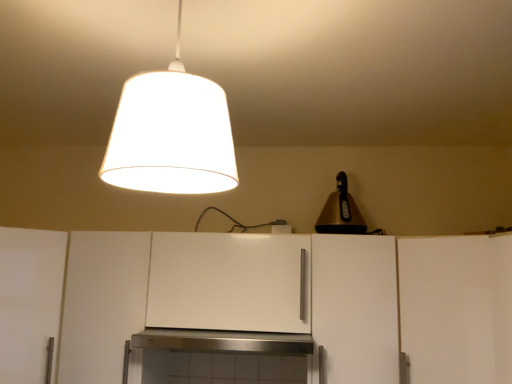
This screenshot has height=384, width=512. What are the coordinates of `white matte cabinet at center, which ranks as the third cabinetry in left-to-right order` in the screenshot? It's located at (230, 282).

The width and height of the screenshot is (512, 384). Describe the element at coordinates (456, 308) in the screenshot. I see `white matte cabinet at right, which is counted as the 5th cabinetry, starting from the left` at that location.

This screenshot has height=384, width=512. I want to click on white matte cabinet at right, which ranks as the 1th cabinetry in right-to-left order, so click(x=456, y=308).

The height and width of the screenshot is (384, 512). I want to click on white fabric lampshade at upper center, placed as the 1th lamp when sorted from front to back, so click(x=170, y=134).

Where is `white matte cabinet at lower left, which appears as the 2th cabinetry when viewed from the left`? white matte cabinet at lower left, which appears as the 2th cabinetry when viewed from the left is located at coordinates (102, 303).

How much space does white matte cabinet at lower left, the 4th cabinetry when ordered from right to left, occupy horizontally?

It is 16.80 inches.

The height and width of the screenshot is (384, 512). Identify the location of white matte cabinet at center, which appears as the 2th cabinetry when viewed from the right. (355, 308).

In order to click on white matte cabinet at center, arranged as the third cabinetry when viewed from the right in this screenshot , I will do `click(230, 282)`.

Is white matte cabinet at lower left, which appears as the 2th cabinetry when viewed from the left, bigger or smaller than white matte cabinet at center, which ranks as the third cabinetry in left-to-right order?

Clearly, white matte cabinet at lower left, which appears as the 2th cabinetry when viewed from the left, is larger in size than white matte cabinet at center, which ranks as the third cabinetry in left-to-right order.

In the scene shown: Would you say white matte cabinet at lower left, which appears as the 2th cabinetry when viewed from the left, is outside white matte cabinet at center, arranged as the third cabinetry when viewed from the right?

That's correct, white matte cabinet at lower left, which appears as the 2th cabinetry when viewed from the left, is outside of white matte cabinet at center, arranged as the third cabinetry when viewed from the right.

From the image's perspective, is white matte cabinet at lower left, the 4th cabinetry when ordered from right to left, located above white matte cabinet at center, which ranks as the third cabinetry in left-to-right order?

Actually, white matte cabinet at lower left, the 4th cabinetry when ordered from right to left, appears below white matte cabinet at center, which ranks as the third cabinetry in left-to-right order, in the image.

Which of these two, white matte cabinet at lower left, which appears as the 2th cabinetry when viewed from the left, or white matte cabinet at center, which ranks as the third cabinetry in left-to-right order, stands shorter?

white matte cabinet at center, which ranks as the third cabinetry in left-to-right order.

From the picture: Does white matte cabinet at lower left, the 4th cabinetry when ordered from right to left, have a lesser width compared to white fabric lampshade at upper center, which appears as the second lamp when viewed from the back?

No.

Which is correct: white matte cabinet at lower left, the 4th cabinetry when ordered from right to left, is inside white fabric lampshade at upper center, which ranks as the 1th lamp in left-to-right order, or outside of it?

white matte cabinet at lower left, the 4th cabinetry when ordered from right to left, is spatially situated outside white fabric lampshade at upper center, which ranks as the 1th lamp in left-to-right order.

Which lamp is the 1st one when counting from the right side of the white matte cabinet at lower left, which appears as the 2th cabinetry when viewed from the left? Please provide its 2D coordinates.

[(170, 134)]

From the image's perspective, who appears lower, white matte cabinet at lower left, which appears as the 2th cabinetry when viewed from the left, or white fabric lampshade at upper center, which ranks as the 1th lamp in left-to-right order?

white matte cabinet at lower left, which appears as the 2th cabinetry when viewed from the left, appears lower in the image.

From the image's perspective, would you say white matte cabinet at center, which appears as the 2th cabinetry when viewed from the right, is positioned over white matte cabinet at left, the fifth cabinetry viewed from the right?

Yes, from the image's perspective, white matte cabinet at center, which appears as the 2th cabinetry when viewed from the right, is over white matte cabinet at left, the fifth cabinetry viewed from the right.

Is white matte cabinet at center, which appears as the 2th cabinetry when viewed from the right, thinner than white matte cabinet at left, the fifth cabinetry viewed from the right?

Yes, white matte cabinet at center, which appears as the 2th cabinetry when viewed from the right, is thinner than white matte cabinet at left, the fifth cabinetry viewed from the right.

Considering the sizes of objects white matte cabinet at center, which appears as the 2th cabinetry when viewed from the right, and white matte cabinet at left, the fifth cabinetry viewed from the right, in the image provided, who is taller, white matte cabinet at center, which appears as the 2th cabinetry when viewed from the right, or white matte cabinet at left, the fifth cabinetry viewed from the right,?

With more height is white matte cabinet at left, the fifth cabinetry viewed from the right.

Which point is more forward, [327,292] or [22,304]?

Point [22,304]

Considering the sizes of objects gold metallic bell at upper right, the 2th lamp in the front-to-back sequence, and white matte cabinet at center, which appears as the 2th cabinetry when viewed from the right, in the image provided, who is thinner, gold metallic bell at upper right, the 2th lamp in the front-to-back sequence, or white matte cabinet at center, which appears as the 2th cabinetry when viewed from the right,?

gold metallic bell at upper right, the 2th lamp in the front-to-back sequence.

Are gold metallic bell at upper right, the 2th lamp in the front-to-back sequence, and white matte cabinet at center, which appears as the 2th cabinetry when viewed from the right, making contact?

No, gold metallic bell at upper right, the 2th lamp in the front-to-back sequence, is not touching white matte cabinet at center, which appears as the 2th cabinetry when viewed from the right.

I want to click on the 1st lamp positioned above the white matte cabinet at center, the fourth cabinetry positioned from the left (from the image's perspective), so click(340, 212).

Does gold metallic bell at upper right, which is the first lamp from back to front, appear on the right side of white matte cabinet at center, the fourth cabinetry positioned from the left?

Yes.

Considering the points (35, 324) and (320, 365), which point is in front, point (35, 324) or point (320, 365)?

Point (320, 365)

Is white matte cabinet at center, which appears as the 2th cabinetry when viewed from the right, at the back of white matte cabinet at left, the fifth cabinetry viewed from the right?

That's not correct — white matte cabinet at left, the fifth cabinetry viewed from the right, is not looking away from white matte cabinet at center, which appears as the 2th cabinetry when viewed from the right.

Is white matte cabinet at left, the fifth cabinetry viewed from the right, taller than white matte cabinet at center, the fourth cabinetry positioned from the left?

Yes, white matte cabinet at left, the fifth cabinetry viewed from the right, is taller than white matte cabinet at center, the fourth cabinetry positioned from the left.

How far apart are white matte cabinet at left, the first cabinetry viewed from the left, and white matte cabinet at center, which appears as the 2th cabinetry when viewed from the right?

1.04 meters.

Is gold metallic bell at upper right, which is the first lamp from back to front, facing towards white matte cabinet at left, the fifth cabinetry viewed from the right?

No, gold metallic bell at upper right, which is the first lamp from back to front, is not oriented towards white matte cabinet at left, the fifth cabinetry viewed from the right.

From the image's perspective, is gold metallic bell at upper right, the 2th lamp in the front-to-back sequence, beneath white matte cabinet at left, the first cabinetry viewed from the left?

No.

Considering the relative sizes of gold metallic bell at upper right, which is counted as the first lamp, starting from the right, and white matte cabinet at left, the fifth cabinetry viewed from the right, in the image provided, is gold metallic bell at upper right, which is counted as the first lamp, starting from the right, shorter than white matte cabinet at left, the fifth cabinetry viewed from the right,?

Yes, gold metallic bell at upper right, which is counted as the first lamp, starting from the right, is shorter than white matte cabinet at left, the fifth cabinetry viewed from the right.

Is white matte cabinet at right, which ranks as the 1th cabinetry in right-to-left order, touching white fabric lampshade at upper center, which appears as the second lamp when viewed from the back?

white matte cabinet at right, which ranks as the 1th cabinetry in right-to-left order, is not next to white fabric lampshade at upper center, which appears as the second lamp when viewed from the back, and they're not touching.

Find the location of `the 2nd lamp to the left when counting from the white matte cabinet at right, which is counted as the 5th cabinetry, starting from the left`. the 2nd lamp to the left when counting from the white matte cabinet at right, which is counted as the 5th cabinetry, starting from the left is located at coordinates (170, 134).

From a real-world perspective, is white matte cabinet at right, which is counted as the 5th cabinetry, starting from the left, above or below white fabric lampshade at upper center, which ranks as the 1th lamp in left-to-right order?

white matte cabinet at right, which is counted as the 5th cabinetry, starting from the left, is situated lower than white fabric lampshade at upper center, which ranks as the 1th lamp in left-to-right order, in the real world.

Considering the sizes of objects white matte cabinet at right, which is counted as the 5th cabinetry, starting from the left, and white fabric lampshade at upper center, placed as the 1th lamp when sorted from front to back, in the image provided, who is taller, white matte cabinet at right, which is counted as the 5th cabinetry, starting from the left, or white fabric lampshade at upper center, placed as the 1th lamp when sorted from front to back,?

With more height is white matte cabinet at right, which is counted as the 5th cabinetry, starting from the left.

From the image's perspective, starting from the white matte cabinet at lower left, which appears as the 2th cabinetry when viewed from the left, which cabinetry is the 4th one above? Please provide its 2D coordinates.

[(230, 282)]

Find the location of a particular element. The image size is (512, 384). cabinetry that is the 1st one when counting leftward from the white fabric lampshade at upper center, placed as the 1th lamp when sorted from front to back is located at coordinates (102, 303).

Considering their positions, is white matte cabinet at center, the fourth cabinetry positioned from the left, positioned closer to gold metallic bell at upper right, acting as the 2th lamp starting from the left, than white matte cabinet at lower left, the 4th cabinetry when ordered from right to left?

white matte cabinet at center, the fourth cabinetry positioned from the left.

When comparing their distances from white matte cabinet at lower left, the 4th cabinetry when ordered from right to left, does white fabric lampshade at upper center, placed as the 1th lamp when sorted from front to back, or white matte cabinet at center, which ranks as the third cabinetry in left-to-right order, seem further?

The object further to white matte cabinet at lower left, the 4th cabinetry when ordered from right to left, is white fabric lampshade at upper center, placed as the 1th lamp when sorted from front to back.

From the image, which object appears to be farther from white matte cabinet at center, which ranks as the third cabinetry in left-to-right order, white matte cabinet at left, the fifth cabinetry viewed from the right, or gold metallic bell at upper right, which is the first lamp from back to front?

white matte cabinet at left, the fifth cabinetry viewed from the right.

From the image, which object appears to be nearer to gold metallic bell at upper right, acting as the 2th lamp starting from the left, white matte cabinet at lower left, the 4th cabinetry when ordered from right to left, or white matte cabinet at right, which ranks as the 1th cabinetry in right-to-left order?

Among the two, white matte cabinet at right, which ranks as the 1th cabinetry in right-to-left order, is located nearer to gold metallic bell at upper right, acting as the 2th lamp starting from the left.

Based on their spatial positions, is white matte cabinet at left, the first cabinetry viewed from the left, or white matte cabinet at center, which ranks as the third cabinetry in left-to-right order, further from white fabric lampshade at upper center, which appears as the second lamp when viewed from the back?

white matte cabinet at left, the first cabinetry viewed from the left, is further to white fabric lampshade at upper center, which appears as the second lamp when viewed from the back.

When comparing their distances from gold metallic bell at upper right, acting as the 2th lamp starting from the left, does white matte cabinet at left, the fifth cabinetry viewed from the right, or white fabric lampshade at upper center, placed as the 1th lamp when sorted from front to back, seem closer?

Among the two, white fabric lampshade at upper center, placed as the 1th lamp when sorted from front to back, is located nearer to gold metallic bell at upper right, acting as the 2th lamp starting from the left.

When comparing their distances from white matte cabinet at left, the fifth cabinetry viewed from the right, does white fabric lampshade at upper center, placed as the 1th lamp when sorted from front to back, or white matte cabinet at center, arranged as the third cabinetry when viewed from the right, seem further?

Based on the image, white fabric lampshade at upper center, placed as the 1th lamp when sorted from front to back, appears to be further to white matte cabinet at left, the fifth cabinetry viewed from the right.

When comparing their distances from white matte cabinet at center, arranged as the third cabinetry when viewed from the right, does white fabric lampshade at upper center, which appears as the second lamp when viewed from the back, or white matte cabinet at left, the fifth cabinetry viewed from the right, seem further?

The object further to white matte cabinet at center, arranged as the third cabinetry when viewed from the right, is white fabric lampshade at upper center, which appears as the second lamp when viewed from the back.

The width and height of the screenshot is (512, 384). What are the coordinates of `cabinetry situated between white matte cabinet at left, the first cabinetry viewed from the left, and white matte cabinet at center, which ranks as the third cabinetry in left-to-right order, from left to right` in the screenshot? It's located at (102, 303).

You are a GUI agent. You are given a task and a screenshot of the screen. Output one action in this format:
    pyautogui.click(x=<x>, y=<y>)
    Task: Click on the lamp located between white matte cabinet at left, the first cabinetry viewed from the left, and white matte cabinet at center, which ranks as the third cabinetry in left-to-right order, in the left-right direction
    The width and height of the screenshot is (512, 384).
    Given the screenshot: What is the action you would take?
    pyautogui.click(x=170, y=134)

Where is `lamp situated between white matte cabinet at left, the first cabinetry viewed from the left, and gold metallic bell at upper right, which is counted as the first lamp, starting from the right, from left to right`? The image size is (512, 384). lamp situated between white matte cabinet at left, the first cabinetry viewed from the left, and gold metallic bell at upper right, which is counted as the first lamp, starting from the right, from left to right is located at coordinates (170, 134).

What are the coordinates of `cabinetry between white matte cabinet at center, arranged as the third cabinetry when viewed from the right, and white matte cabinet at right, which ranks as the 1th cabinetry in right-to-left order` in the screenshot? It's located at (355, 308).